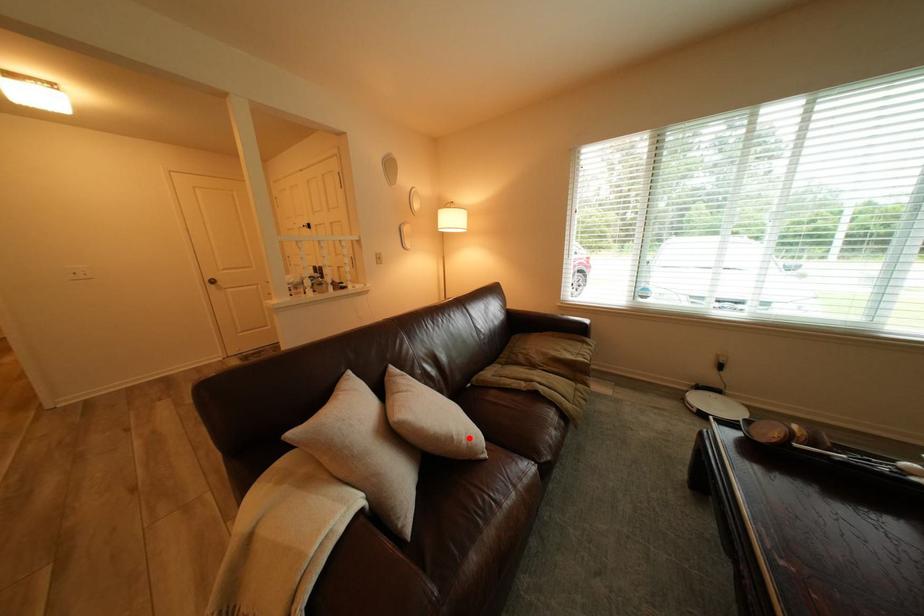
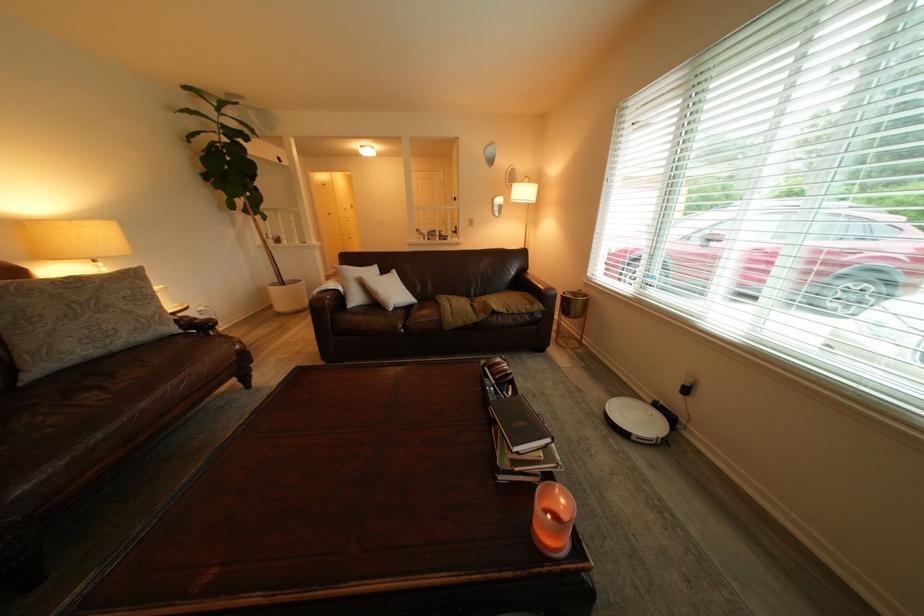
Question: I am providing you with two images of the same scene from different viewpoints. A red point is shown in image1. For the corresponding object point in image2, is it positioned nearer or farther from the camera?

Choices:
 (A) Nearer
 (B) Farther

Answer: (B)